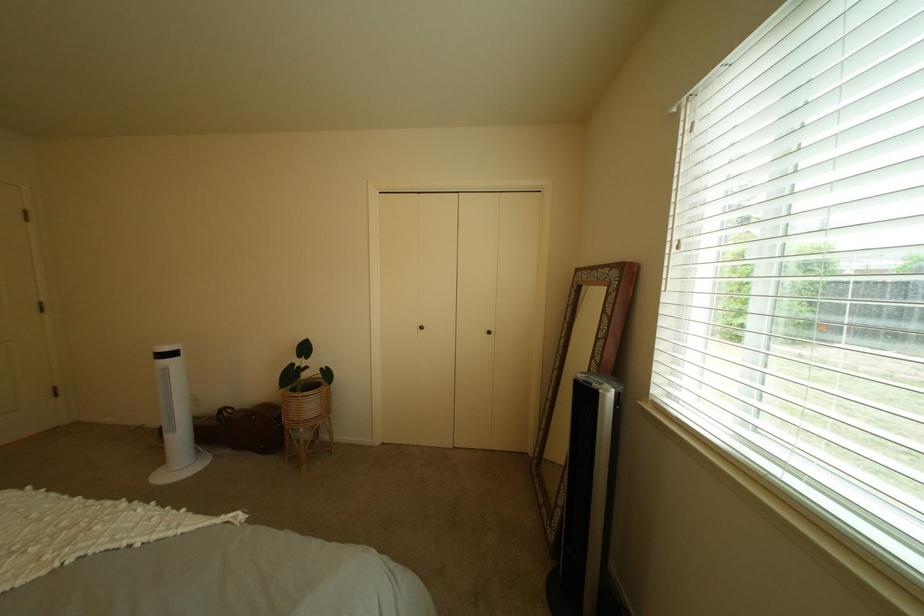
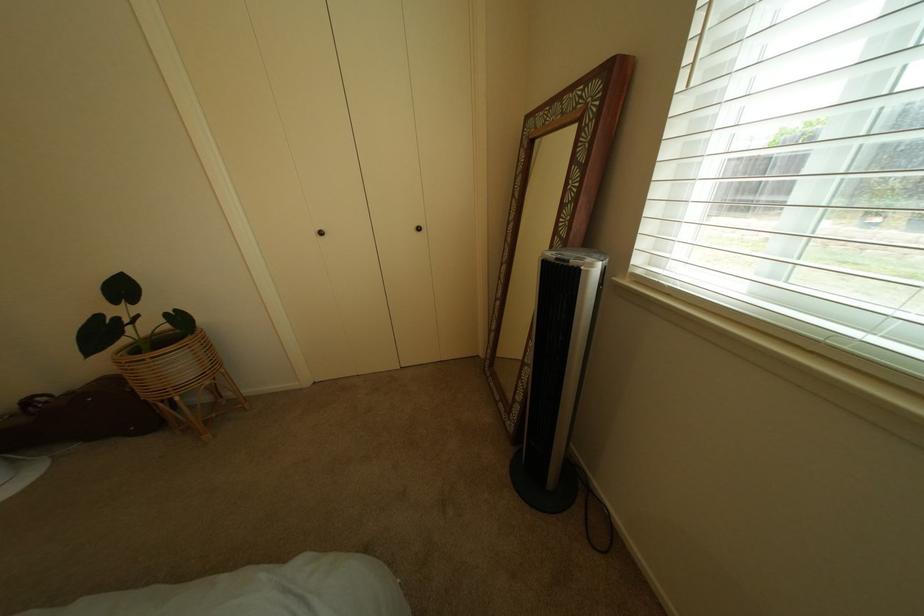
Find the pixel in the second image that matches (x=213, y=453) in the first image.

(30, 463)